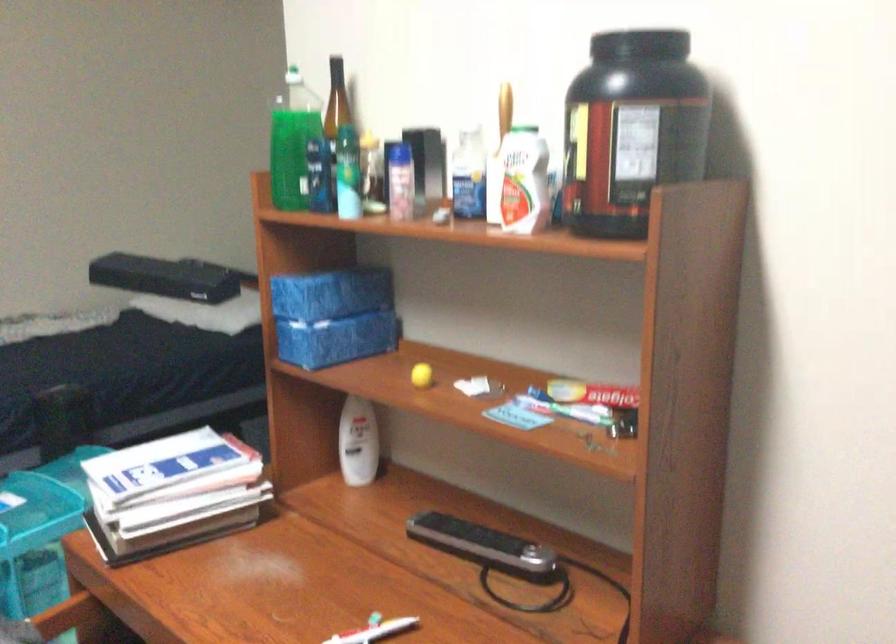
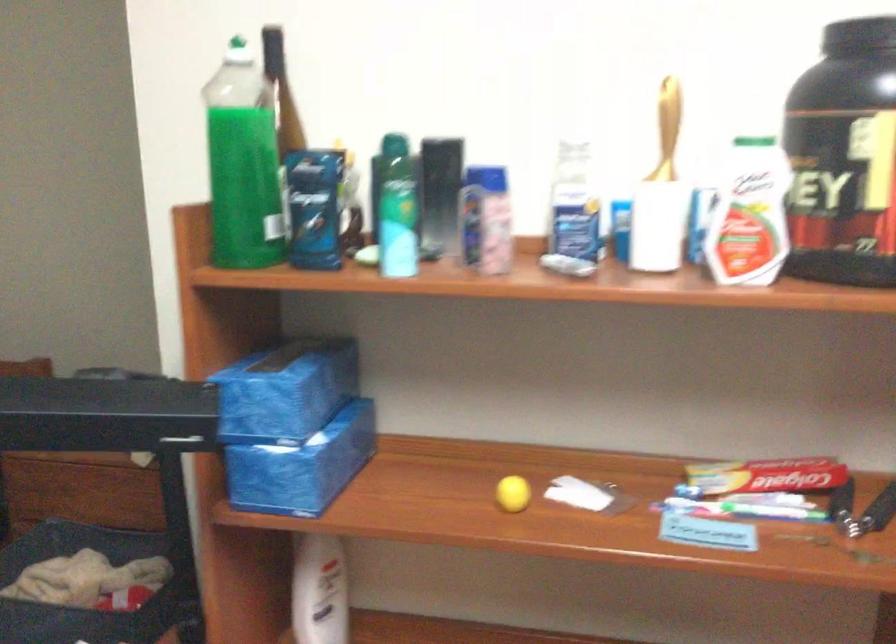
Where in the second image is the point corresponding to (x=349, y=435) from the first image?

(319, 591)